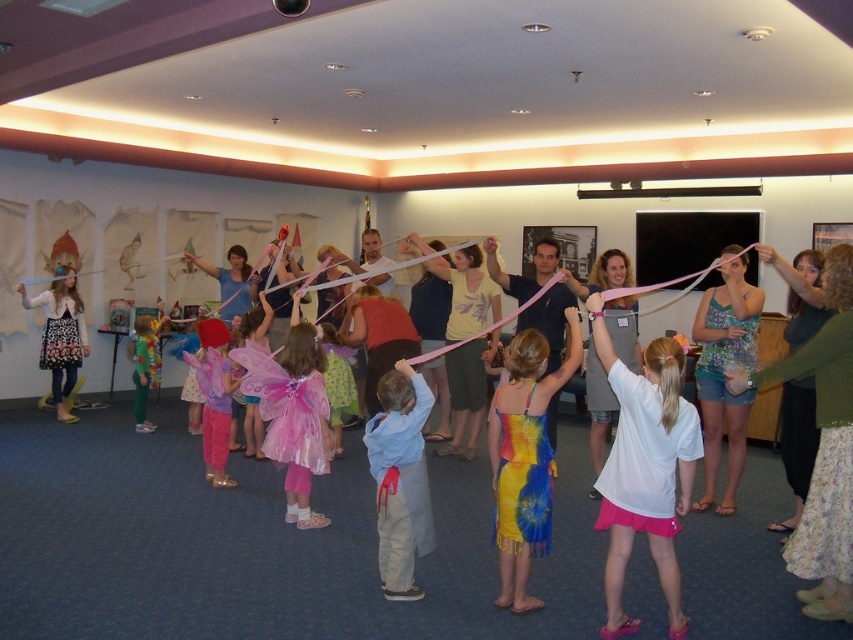
You are standing in the ribbon activity area and want to pick up the ribbon closest to you. Which point should you go to, point (657,573) or point (515,428)?

Point (657,573) is further to the viewer than point (515,428), so you should go to point (657,573) to pick up the closest ribbon.

You are standing at the entrance of the community center and see the scene described. There is a white matte t shirt at center marked by point (x=645, y=468). Can you determine if the point is closer to the entrance or the exit?

The point (x=645, y=468) marks the white matte t shirt at center, so it is equidistant from both the entrance and exit.